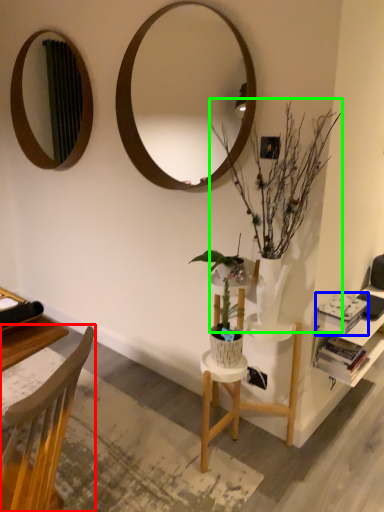
Question: Based on their relative distances, which object is farther from chair (highlighted by a red box)? Choose from book (highlighted by a blue box) and houseplant (highlighted by a green box).

Choices:
 (A) book
 (B) houseplant

Answer: (A)